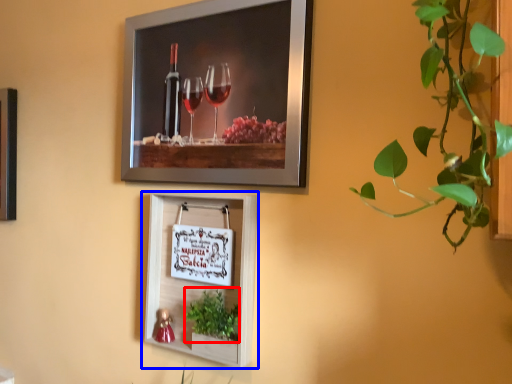
Question: Among these objects, which one is nearest to the camera, plant (highlighted by a red box) or picture frame (highlighted by a blue box)?

Choices:
 (A) plant
 (B) picture frame

Answer: (A)